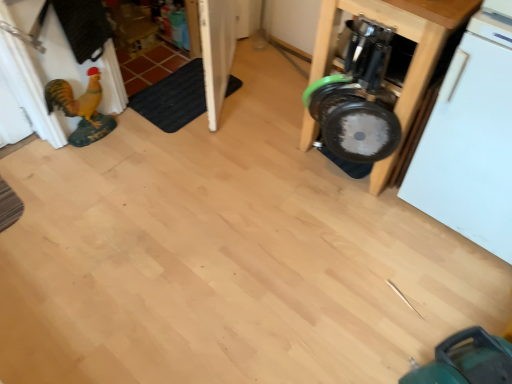
Identify the location of vacant space situated on the left part of metallic silver dumbbell at right. (264, 145).